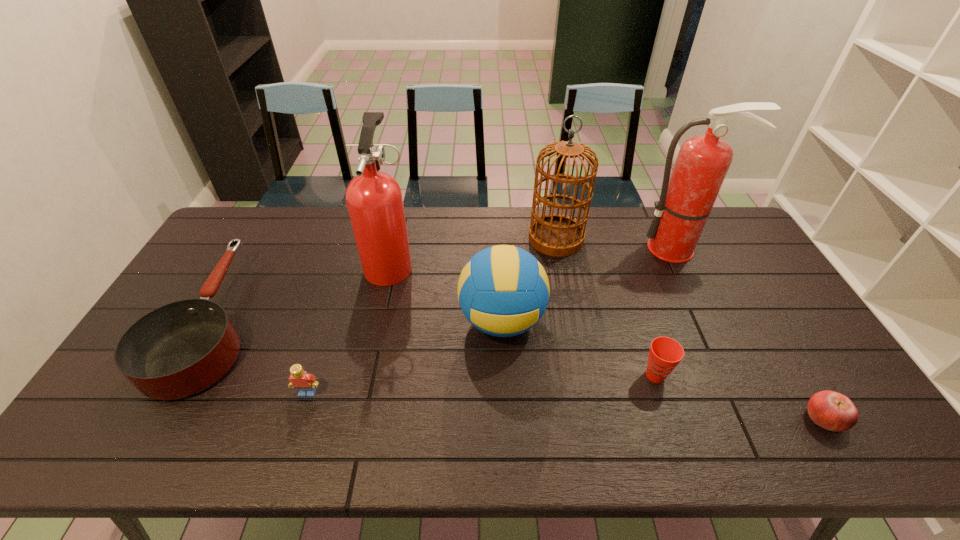
The width and height of the screenshot is (960, 540). Find the location of `free space between the Lego and the birdcage`. free space between the Lego and the birdcage is located at coordinates (432, 316).

Identify the location of free point between the right fire extinguisher and the shortest object. (751, 333).

Find the location of `unoccupied area between the birdcage and the right fire extinguisher`. unoccupied area between the birdcage and the right fire extinguisher is located at coordinates (616, 244).

Identify the location of free space between the apple and the right fire extinguisher. (751, 333).

This screenshot has width=960, height=540. I want to click on vacant space that's between the third object from left to right and the fifth shortest object, so click(446, 292).

I want to click on free point between the cup and the right fire extinguisher, so click(x=666, y=312).

This screenshot has width=960, height=540. What are the coordinates of `vacant area that lies between the leftmost object and the right fire extinguisher` in the screenshot? It's located at [x=445, y=285].

Identify the location of the third closest object to the cup. (686, 200).

At what (x,y) coordinates should I click in order to perform the action: click on object that is the sixth closest to the leftmost object. Please return your answer as a coordinate pair (x, y). Image resolution: width=960 pixels, height=540 pixels. Looking at the image, I should click on (686, 200).

Where is `vacant space that satisfies the following two spatial constraints: 1. on the handle side of the leftmost object; 2. on the left side of the birdcage`? The width and height of the screenshot is (960, 540). vacant space that satisfies the following two spatial constraints: 1. on the handle side of the leftmost object; 2. on the left side of the birdcage is located at coordinates (260, 239).